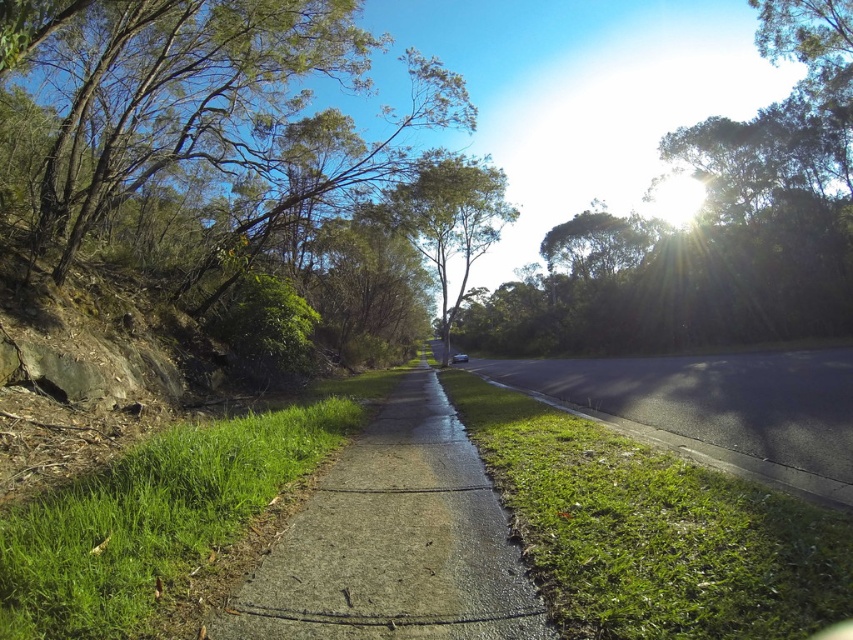
You are a pedestrian standing at the start of the pathway and want to reach the road ahead. The green leafy tree at upper center and the black asphalt pavement at center are in your view. Which object is larger in size?

The green leafy tree at upper center is bigger than the black asphalt pavement at center, so the green leafy tree at upper center is larger in size.

You are a gardener planning to mow the green grass at lower left and the concrete at center. Which area requires mowing first based on their height?

The green grass at lower left requires mowing first because it is taller than the concrete at center.